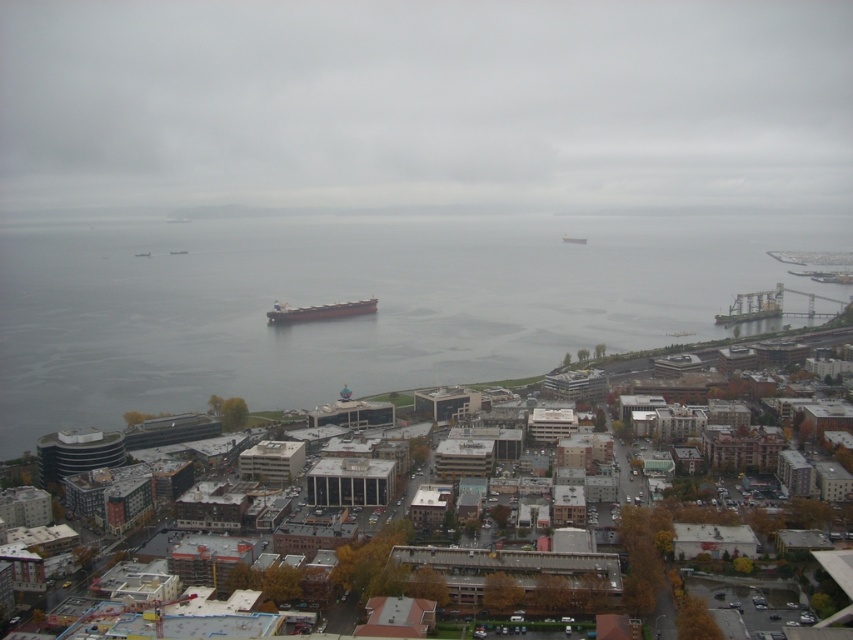
Can you confirm if smooth concrete harbor at center is positioned to the left of metallic gray ship at center?

Incorrect, smooth concrete harbor at center is not on the left side of metallic gray ship at center.

Between smooth concrete harbor at center and metallic gray ship at center, which one has more height?

smooth concrete harbor at center is taller.

Image resolution: width=853 pixels, height=640 pixels. Describe the element at coordinates (815, 333) in the screenshot. I see `smooth concrete harbor at center` at that location.

The width and height of the screenshot is (853, 640). I want to click on smooth concrete harbor at center, so click(x=815, y=333).

Is gray cloudy sky at upper center taller than gray matte cargo ship at center?

Indeed, gray cloudy sky at upper center has a greater height compared to gray matte cargo ship at center.

Does gray cloudy sky at upper center appear on the left side of gray matte cargo ship at center?

Correct, you'll find gray cloudy sky at upper center to the left of gray matte cargo ship at center.

Find the location of a particular element. gray cloudy sky at upper center is located at coordinates (422, 108).

Consider the image. Is gray cloudy sky at upper center shorter than smooth concrete harbor at center?

In fact, gray cloudy sky at upper center may be taller than smooth concrete harbor at center.

Who is taller, gray cloudy sky at upper center or smooth concrete harbor at center?

gray cloudy sky at upper center

Between point (482, 140) and point (648, 356), which one is positioned in front?

Positioned in front is point (648, 356).

The height and width of the screenshot is (640, 853). Identify the location of gray cloudy sky at upper center. (422, 108).